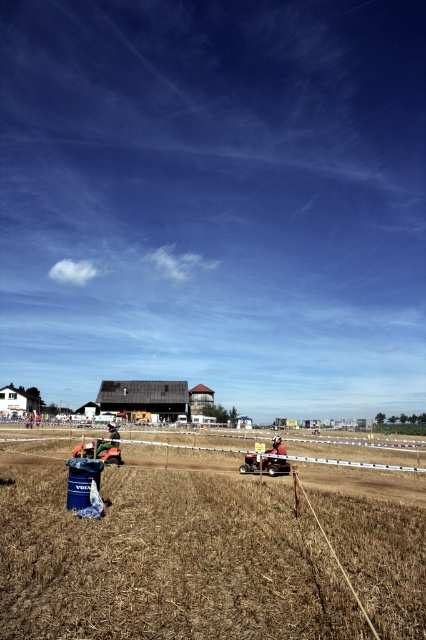
Question: Which object is positioned closest to the metallic red plow at center?

Choices:
 (A) brown dry grass at center
 (B) metallic silver motorcycle at center

Answer: (A)

Question: In this image, where is metallic red plow at center located relative to metallic silver motorcycle at center?

Choices:
 (A) below
 (B) above

Answer: (B)

Question: Among these points, which one is nearest to the camera?

Choices:
 (A) (140, 632)
 (B) (108, 444)

Answer: (A)

Question: Is brown dry grass at center above metallic red plow at center?

Choices:
 (A) no
 (B) yes

Answer: (A)

Question: Which object is positioned farthest from the metallic silver motorcycle at center?

Choices:
 (A) metallic red plow at center
 (B) brown dry grass at center

Answer: (A)

Question: In this image, where is brown dry grass at center located relative to metallic red plow at center?

Choices:
 (A) below
 (B) above

Answer: (A)